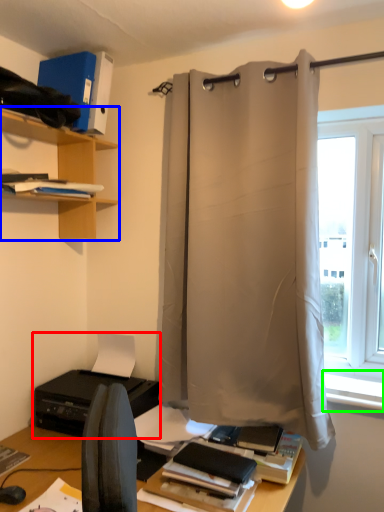
Question: Estimate the real-world distances between objects in this image. Which object is closer to printer (highlighted by a red box), shelf (highlighted by a blue box) or window sill (highlighted by a green box)?

Choices:
 (A) shelf
 (B) window sill

Answer: (A)